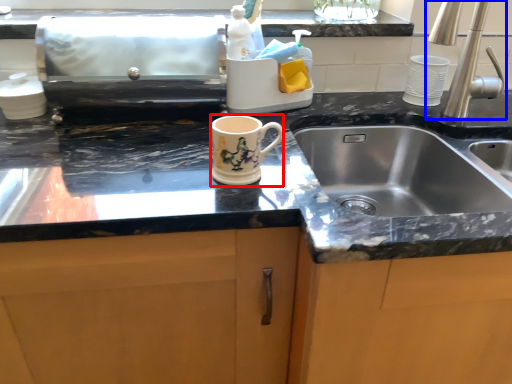
Question: Which object appears farthest to the camera in this image, mug (highlighted by a red box) or tap (highlighted by a blue box)?

Choices:
 (A) mug
 (B) tap

Answer: (B)